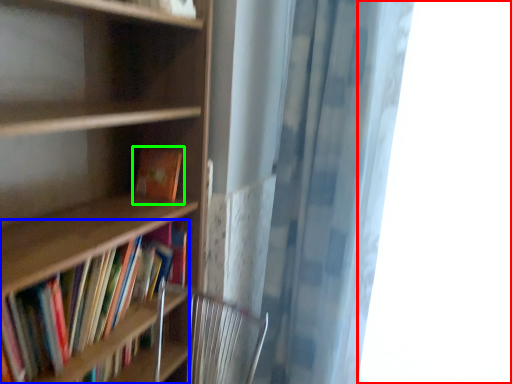
Question: Which is nearer to the window (highlighted by a red box)? book (highlighted by a blue box) or book (highlighted by a green box).

Choices:
 (A) book
 (B) book

Answer: (B)